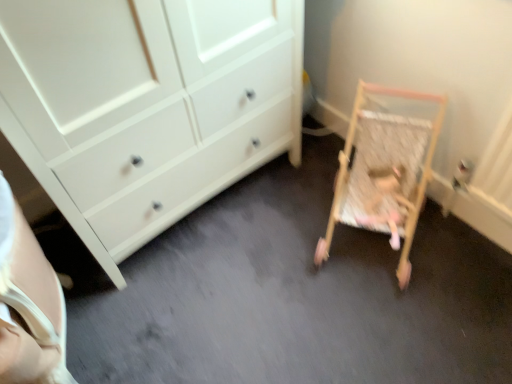
Question: From the image's perspective, is wooden rocking chair at right above or below wooden baby cot at lower right?

Choices:
 (A) below
 (B) above

Answer: (A)

Question: Do you think wooden rocking chair at right is within wooden baby cot at lower right, or outside of it?

Choices:
 (A) outside
 (B) inside

Answer: (B)

Question: In terms of width, does wooden rocking chair at right look wider or thinner when compared to wooden baby cot at lower right?

Choices:
 (A) wide
 (B) thin

Answer: (B)

Question: In terms of height, does wooden baby cot at lower right look taller or shorter compared to wooden rocking chair at right?

Choices:
 (A) tall
 (B) short

Answer: (A)

Question: Is point (380, 92) positioned closer to the camera than point (358, 223)?

Choices:
 (A) farther
 (B) closer

Answer: (A)

Question: Is wooden baby cot at lower right inside or outside of wooden rocking chair at right?

Choices:
 (A) inside
 (B) outside

Answer: (B)

Question: Is wooden baby cot at lower right wider or thinner than wooden rocking chair at right?

Choices:
 (A) thin
 (B) wide

Answer: (B)